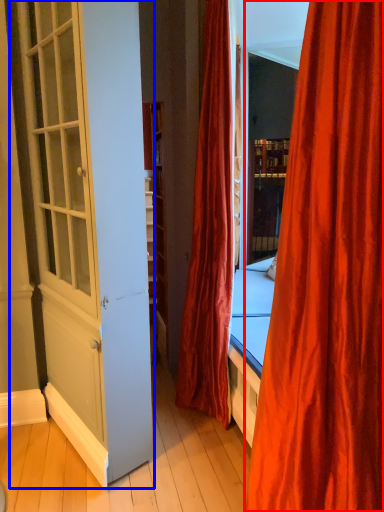
Question: Which object appears closest to the camera in this image, curtain (highlighted by a red box) or screen door (highlighted by a blue box)?

Choices:
 (A) curtain
 (B) screen door

Answer: (A)